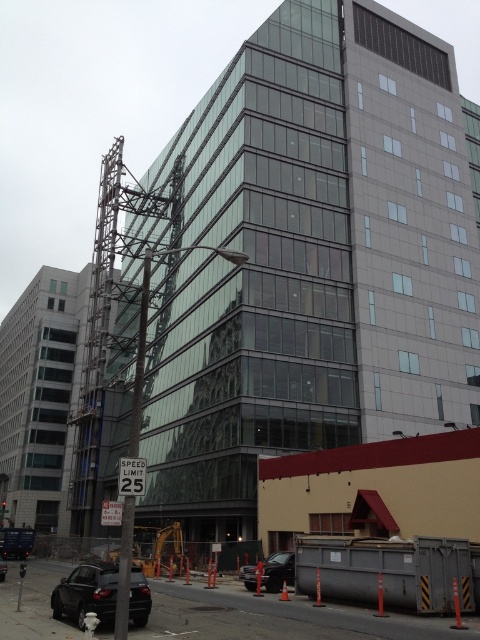
You are a delivery driver who needs to back out of a parking spot near the gray concrete construction site at lower center and the shiny black sedan at lower center. Which object will appear larger in your rearview mirror as you back up?

The gray concrete construction site at lower center will appear larger in your rearview mirror because it is taller than the shiny black sedan at lower center.

You are a city planner analyzing traffic flow. You notice the gray concrete construction site at lower center and the black matte car at lower left. Which object takes up more horizontal space in the image?

The gray concrete construction site at lower center has a greater width than the black matte car at lower left, so it takes up more horizontal space.

You are a delivery driver who needs to park your truck near the gray concrete construction site at lower center without blocking the black matte car at lower left. Can you park your truck there?

The gray concrete construction site at lower center is larger in size than the black matte car at lower left, so there should be enough space to park your truck near the construction site without blocking the car.